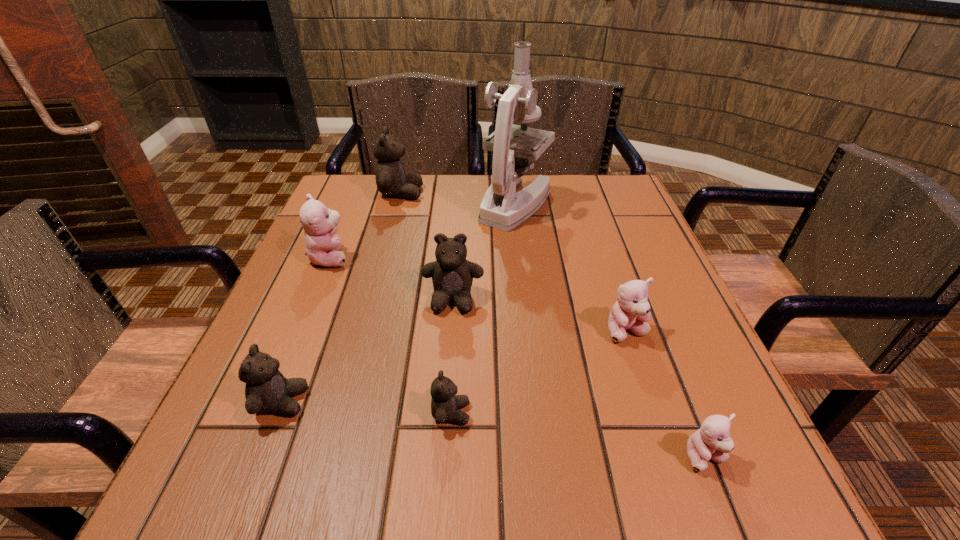
Locate an element on the screen. The height and width of the screenshot is (540, 960). the second smallest pink teddy bear is located at coordinates (631, 312).

In order to click on the smallest brown teddy bear in this screenshot , I will do `click(445, 404)`.

Locate an element on the screen. The image size is (960, 540). the smallest pink teddy bear is located at coordinates (712, 441).

At what (x,y) coordinates should I click in order to perform the action: click on the nearest pink teddy bear. Please return your answer as a coordinate pair (x, y). This screenshot has width=960, height=540. Looking at the image, I should click on (712, 441).

You are a GUI agent. You are given a task and a screenshot of the screen. Output one action in this format:
    pyautogui.click(x=<x>, y=<y>)
    Task: Click on the free location located 0.180m on the front of the microscope
    The width and height of the screenshot is (960, 540).
    Given the screenshot: What is the action you would take?
    pyautogui.click(x=524, y=280)

The width and height of the screenshot is (960, 540). Find the location of `vacant space located on the face of the tallest teddy bear`. vacant space located on the face of the tallest teddy bear is located at coordinates (467, 193).

At what (x,y) coordinates should I click in order to perform the action: click on free space located at the face of the biggest pink teddy bear. Please return your answer as a coordinate pair (x, y). Image resolution: width=960 pixels, height=540 pixels. Looking at the image, I should click on (417, 257).

At what (x,y) coordinates should I click in order to perform the action: click on vacant space located 0.230m on the face of the fifth nearest object. Please return your answer as a coordinate pair (x, y). This screenshot has width=960, height=540. Looking at the image, I should click on (444, 423).

You are a GUI agent. You are given a task and a screenshot of the screen. Output one action in this format:
    pyautogui.click(x=<x>, y=<y>)
    Task: Click on the vacant space located 0.360m on the face of the leftmost brown teddy bear
    This screenshot has width=960, height=540.
    Given the screenshot: What is the action you would take?
    pyautogui.click(x=527, y=401)

Locate an element on the screen. free spot located 0.290m at the face of the second nearest pink teddy bear is located at coordinates (688, 514).